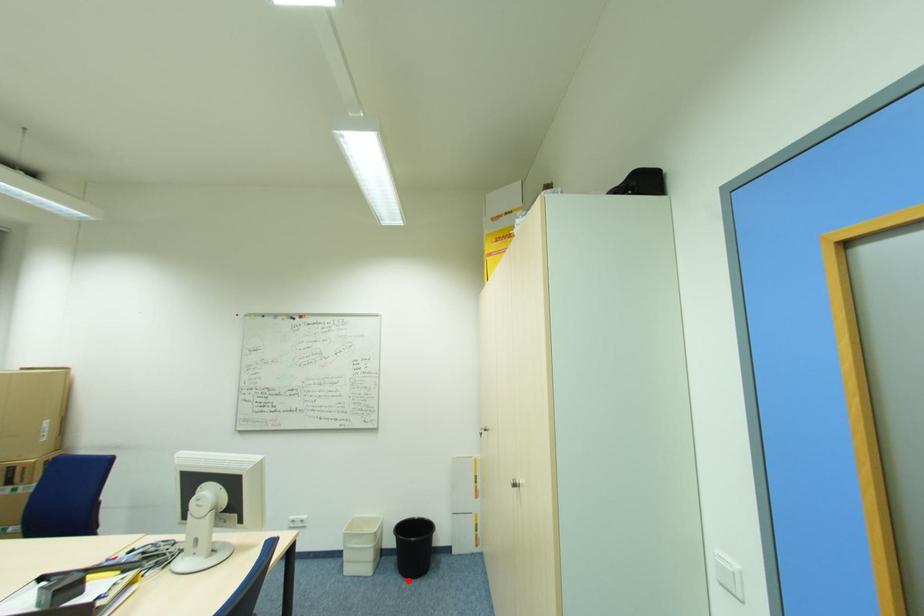
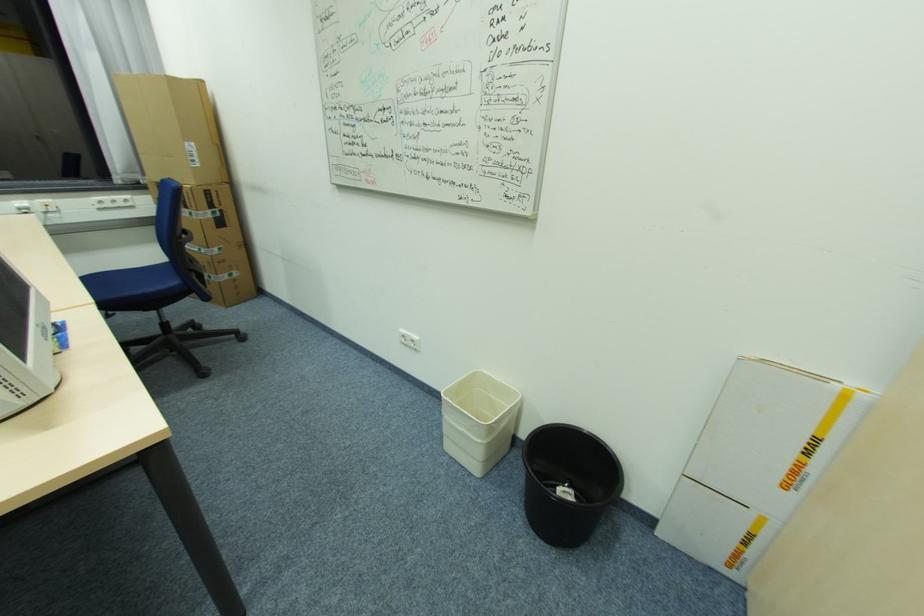
Locate, in the second image, the point that corresponds to the highlighted location in the first image.

(533, 532)